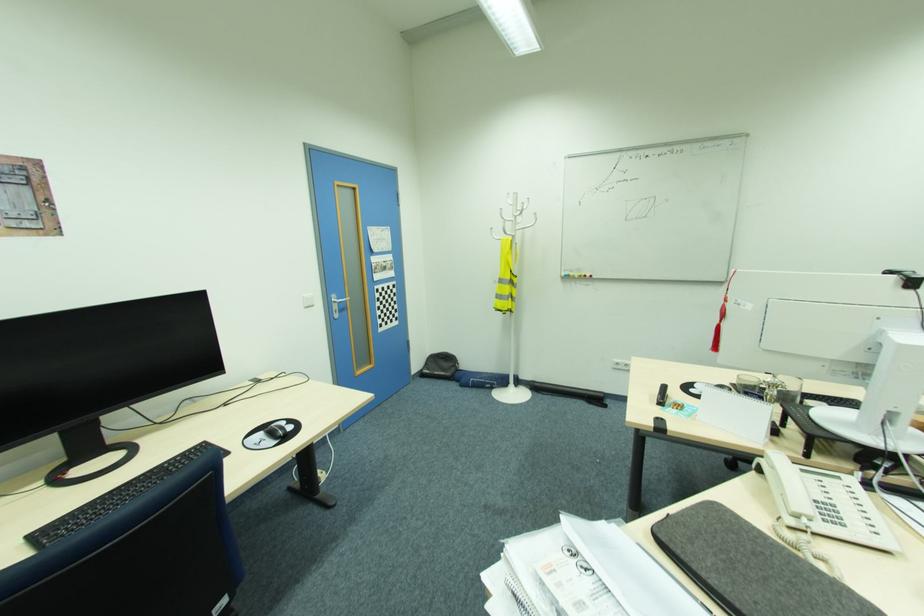
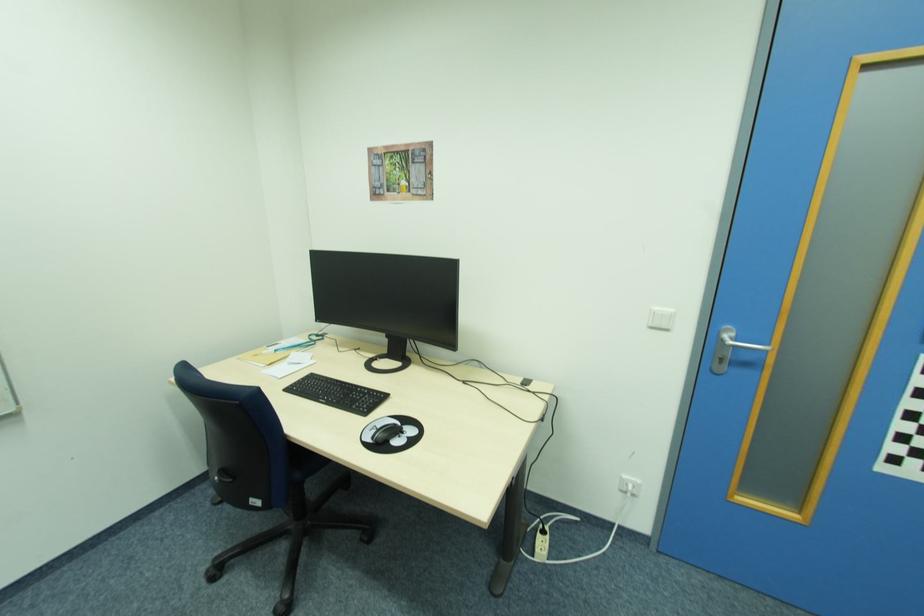
Locate, in the second image, the point that corresponds to [314,306] in the first image.

(670, 329)